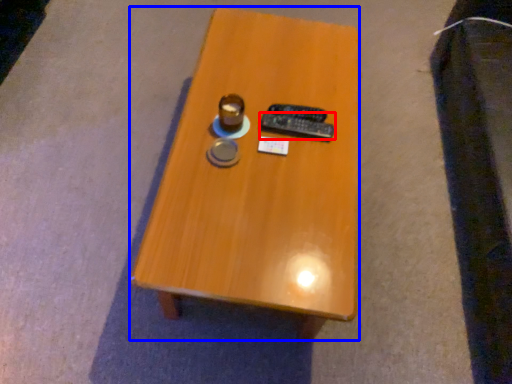
Question: Among these objects, which one is farthest to the camera, remote control (highlighted by a red box) or table (highlighted by a blue box)?

Choices:
 (A) remote control
 (B) table

Answer: (A)